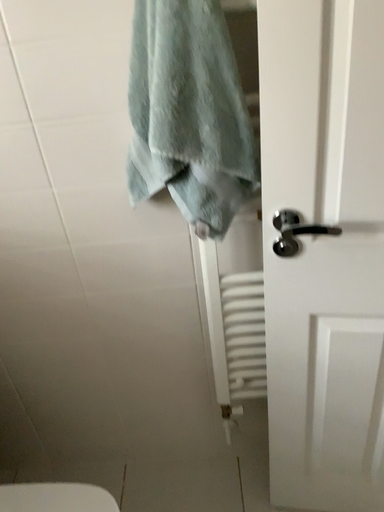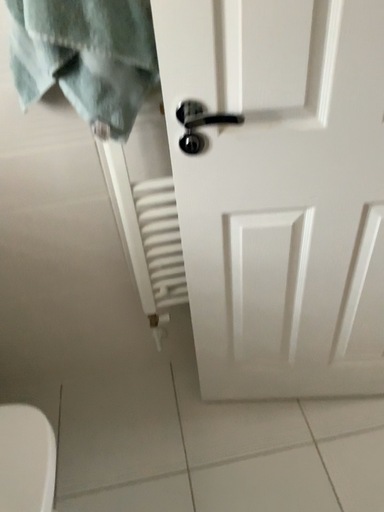
Question: How did the camera likely rotate when shooting the video?

Choices:
 (A) rotated downward
 (B) rotated upward

Answer: (A)